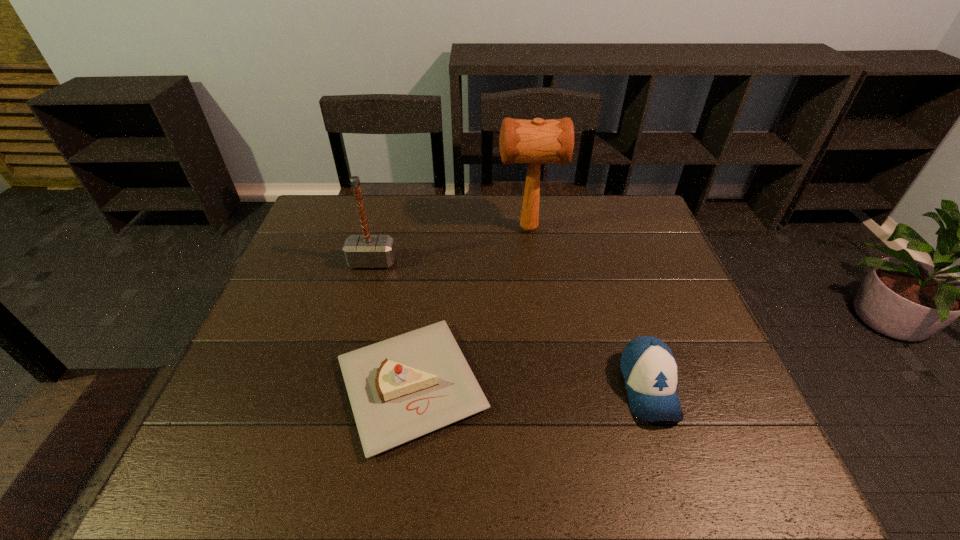
Locate an element on the screen. vacant area that lies between the farthest object and the cake is located at coordinates (469, 307).

Find the location of a particular element. The height and width of the screenshot is (540, 960). free space between the cake and the rightmost object is located at coordinates (530, 386).

Identify the location of vacant space in between the shortest object and the second farthest object. This screenshot has width=960, height=540. (392, 323).

Where is `empty space that is in between the cake and the farthest object`? The image size is (960, 540). empty space that is in between the cake and the farthest object is located at coordinates (469, 307).

Image resolution: width=960 pixels, height=540 pixels. In order to click on empty space that is in between the third nearest object and the farthest object in this screenshot , I will do `click(450, 245)`.

The image size is (960, 540). In order to click on vacant area that lies between the third shortest object and the mallet in this screenshot , I will do `click(450, 245)`.

You are a GUI agent. You are given a task and a screenshot of the screen. Output one action in this format:
    pyautogui.click(x=<x>, y=<y>)
    Task: Click on the vacant area between the hammer and the shortest object
    
    Given the screenshot: What is the action you would take?
    pyautogui.click(x=392, y=323)

Find the location of a particular element. The image size is (960, 540). empty space between the shortest object and the baseball cap is located at coordinates (530, 386).

Locate an element on the screen. free space between the second object from right to left and the shortest object is located at coordinates (469, 307).

Identify the location of vacant space that's between the tallest object and the cake. The height and width of the screenshot is (540, 960). (x=469, y=307).